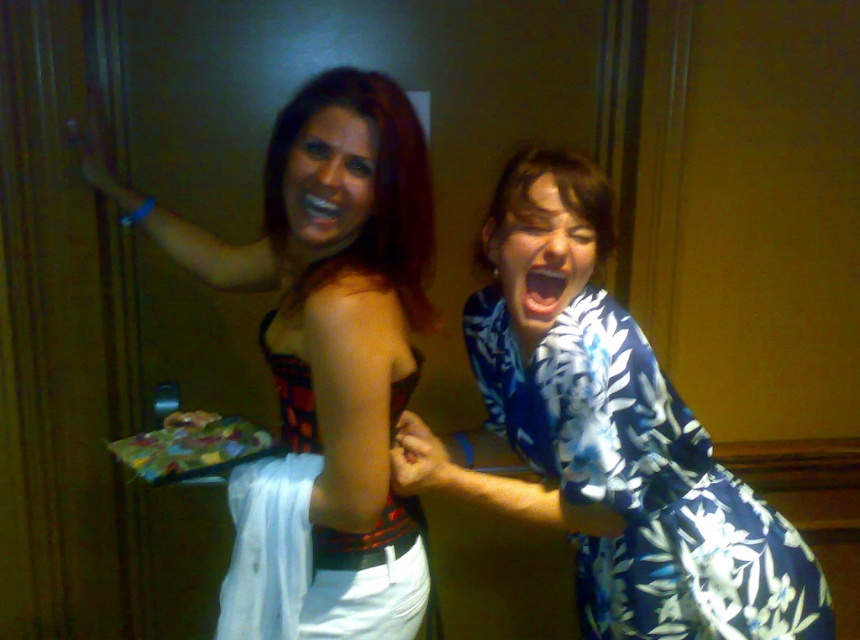
You are organizing a clothing donation drive and need to determine which of the two dresses can fit into a standard donation box that has a maximum capacity for items up to the size of the red plaid fabric dress at center. Can the blue floral dress at right fit into the box?

The blue floral dress at right is bigger than the red plaid fabric dress at center, so it cannot fit into the donation box designed for items up to the size of the red plaid fabric dress at center.

You are organizing a fashion show and need to place the matte black dress at left on a mannequin. The mannequin is located at point 0.514, 0.392. Can you confirm if the coordinates provided are correct for placing the dress?

Yes, the coordinates provided at point (336, 328) are correct for placing the matte black dress at left as it is exactly where the dress is located.

You are standing at the point marked by the coordinate point at point (539,385). You want to move to the door that is 1.17 meters away from you. Is there enough space to walk straight to the door without needing to move sideways?

The distance between you and the door is exactly 1.17 meters, so yes, there is enough space to walk straight to the door without needing to move sideways.